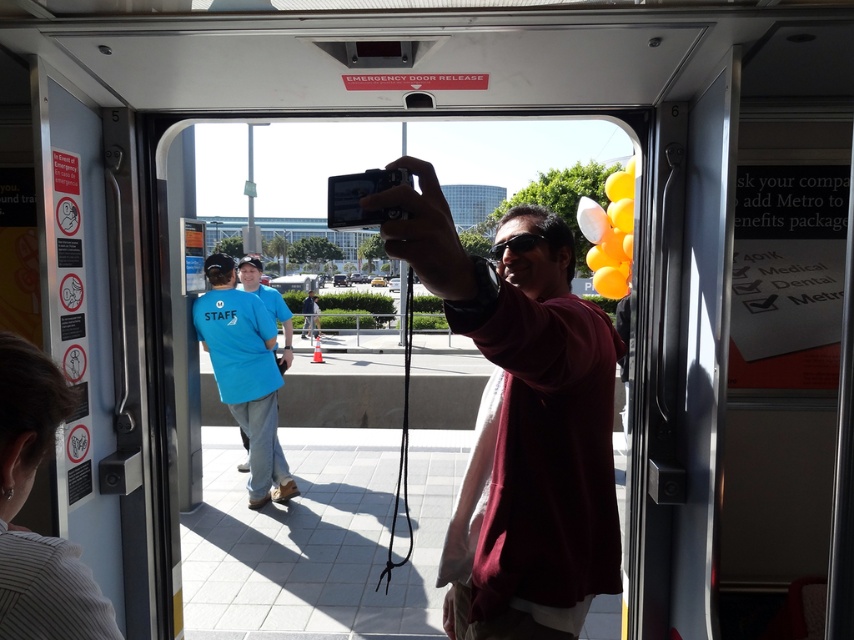
Question: Can you confirm if matte black camera at center is positioned above black plastic camera at center?

Choices:
 (A) yes
 (B) no

Answer: (B)

Question: Which point is farther to the camera?

Choices:
 (A) (182, 161)
 (B) (372, 216)
 (C) (483, 595)

Answer: (A)

Question: Can you confirm if matte black camera at center is positioned to the left of black plastic camera at center?

Choices:
 (A) no
 (B) yes

Answer: (A)

Question: Where is matte black camera at center located in relation to black plastic camera at center in the image?

Choices:
 (A) left
 (B) right

Answer: (B)

Question: Which object is closer to the camera taking this photo?

Choices:
 (A) black plastic camera at center
 (B) matte black camera at center
 (C) transparent glass door at center

Answer: (B)

Question: Considering the real-world distances, which object is closest to the black plastic camera at center?

Choices:
 (A) matte black camera at center
 (B) transparent glass door at center

Answer: (A)